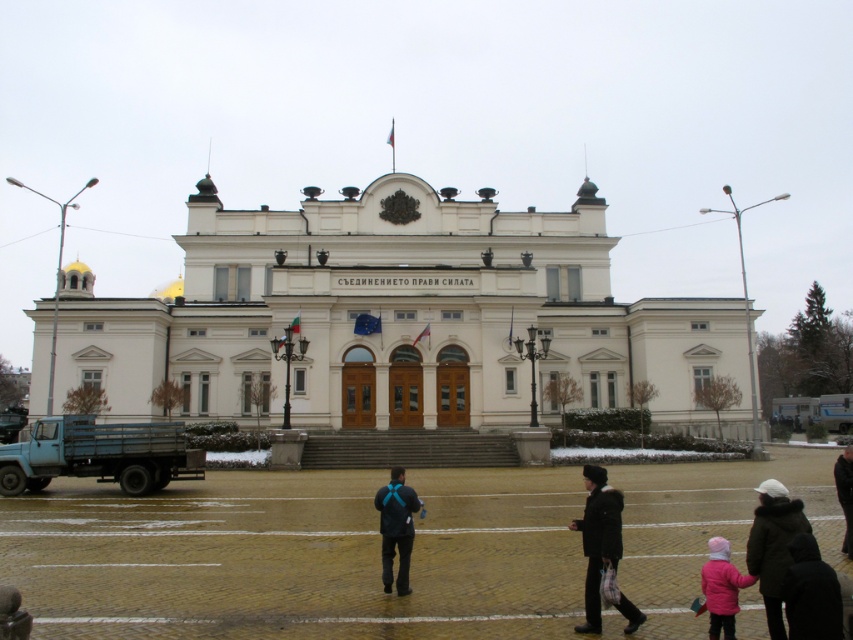
Which is in front, point (712, 620) or point (844, 508)?

Positioned in front is point (712, 620).

Between point (706, 570) and point (842, 477), which one is positioned behind?

The point (842, 477) is more distant.

The width and height of the screenshot is (853, 640). What do you see at coordinates (721, 588) in the screenshot? I see `pink fleece jacket at lower right` at bounding box center [721, 588].

Where is `pink fleece jacket at lower right`? This screenshot has width=853, height=640. pink fleece jacket at lower right is located at coordinates (721, 588).

Does black fuzzy coat at center have a greater height compared to black matte jacket at center?

Yes, black fuzzy coat at center is taller than black matte jacket at center.

This screenshot has width=853, height=640. What are the coordinates of `black fuzzy coat at center` in the screenshot? It's located at (598, 538).

Is white stone building at center further to camera compared to black matte jacket at center?

That is True.

Does point (664, 352) come behind point (408, 544)?

Yes, it is.

You are a GUI agent. You are given a task and a screenshot of the screen. Output one action in this format:
    pyautogui.click(x=<x>, y=<y>)
    Task: Click on the white stone building at center
    This screenshot has width=853, height=640.
    Given the screenshot: What is the action you would take?
    pyautogui.click(x=393, y=320)